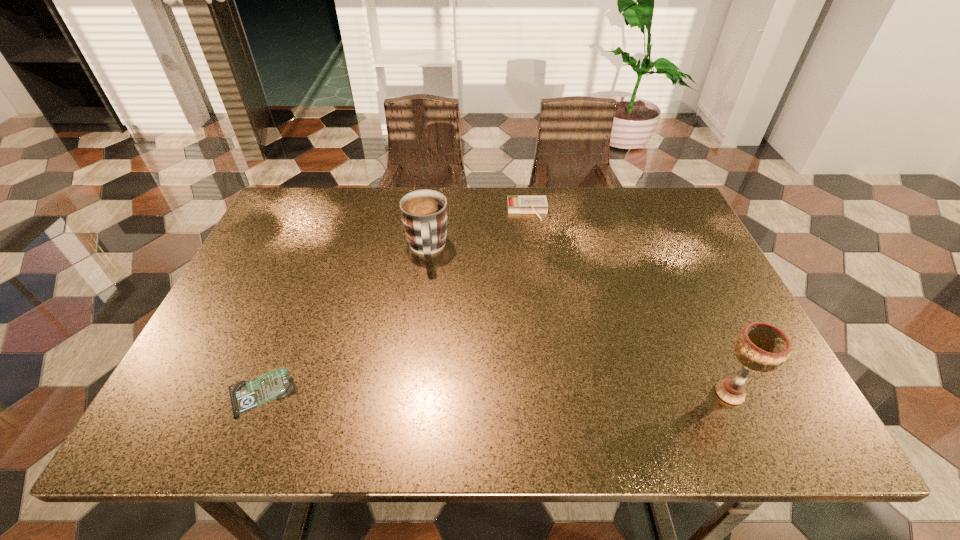
At what (x,y) coordinates should I click in order to perform the action: click on vacant spot on the desktop that is between the leftmost object and the tallest object and is positioned on the side of the second tallest object with the handle. Please return your answer as a coordinate pair (x, y). Image resolution: width=960 pixels, height=540 pixels. Looking at the image, I should click on (434, 392).

Where is `vacant space on the desktop that is between the shortest object and the chalice and is positioned on the striking surface of the third tallest object`? The height and width of the screenshot is (540, 960). vacant space on the desktop that is between the shortest object and the chalice and is positioned on the striking surface of the third tallest object is located at coordinates (554, 393).